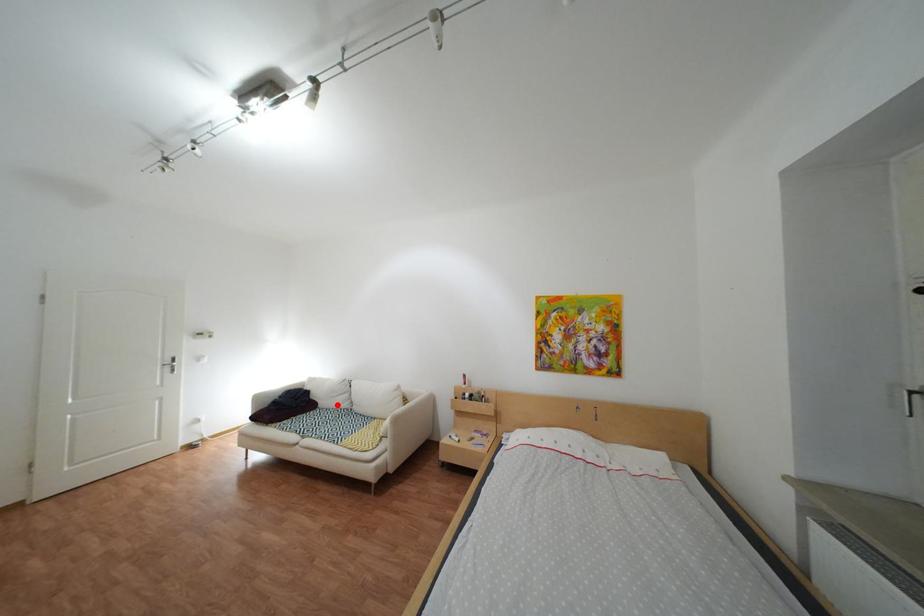
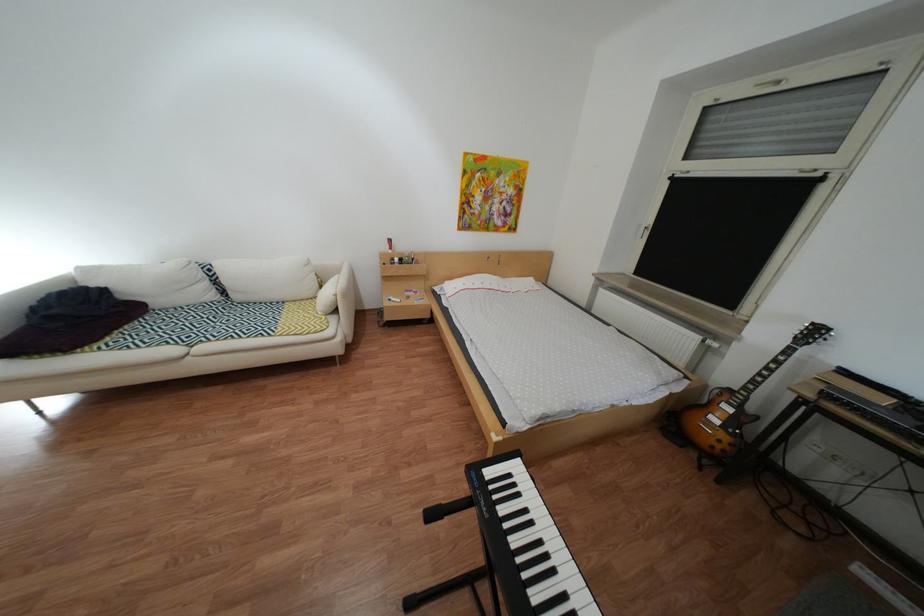
In the second image, find the point that corresponds to the highlighted location in the first image.

(172, 304)